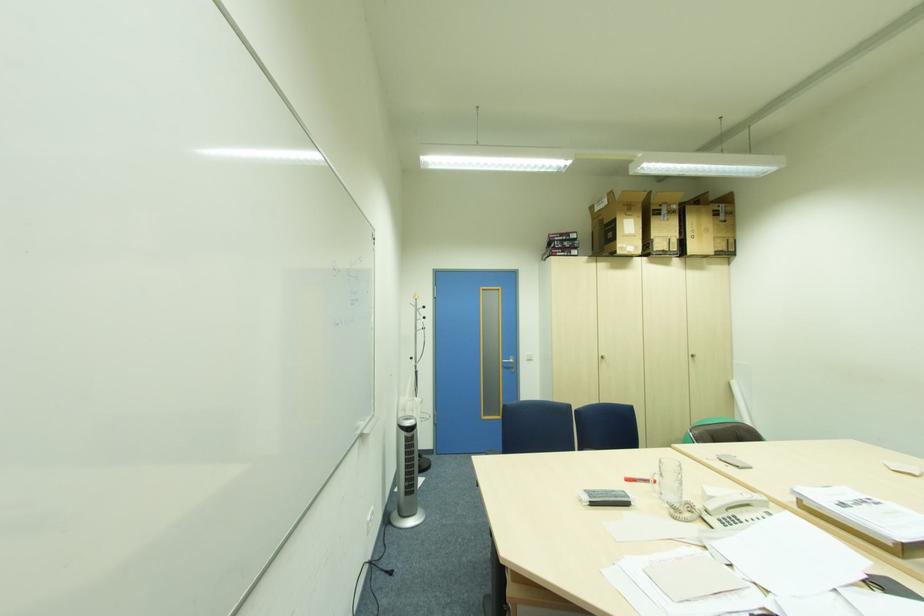
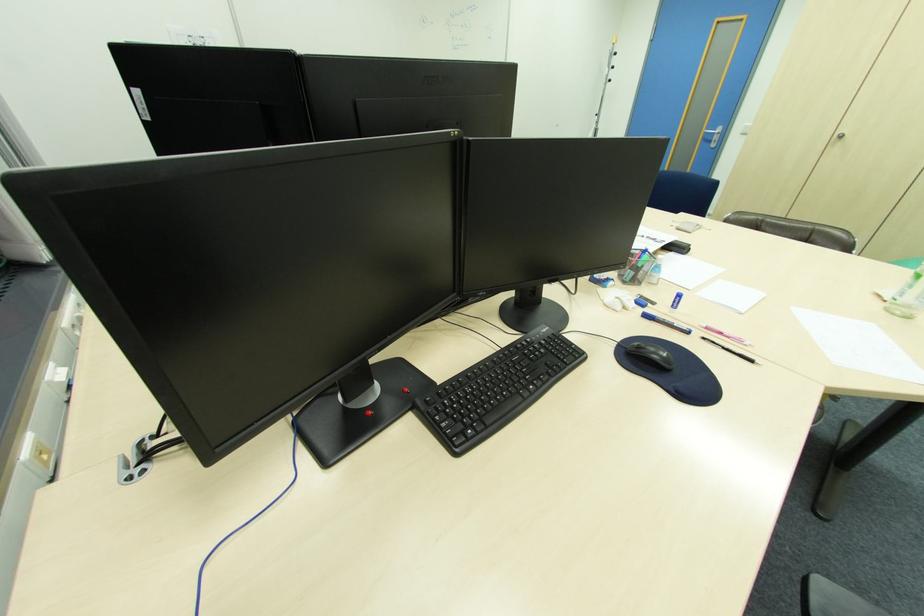
Locate, in the second image, the point that corresponds to (513,367) in the first image.

(713, 139)